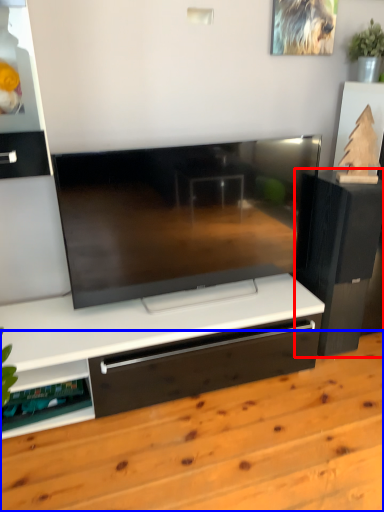
Question: Among these objects, which one is nearest to the camera, furniture (highlighted by a red box) or hardwood (highlighted by a blue box)?

Choices:
 (A) furniture
 (B) hardwood

Answer: (B)